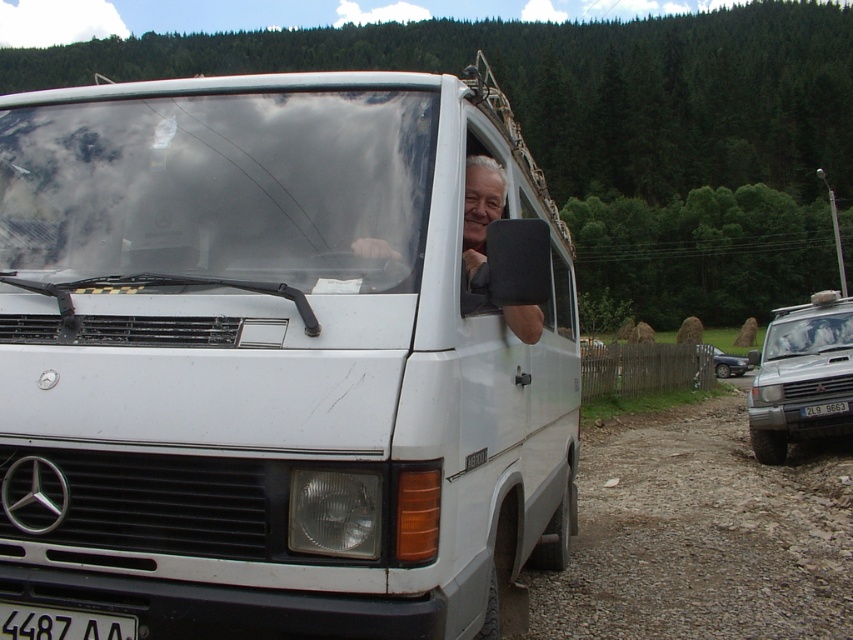
Question: Considering the relative positions of gray fabric shirt at center and black plastic license plate at center in the image provided, where is gray fabric shirt at center located with respect to black plastic license plate at center?

Choices:
 (A) right
 (B) left

Answer: (B)

Question: Which object is the closest to the white matte van at center?

Choices:
 (A) silver metallic suv at right
 (B) black plastic license plate at center
 (C) metallic silver sedan at right
 (D) black plastic license plate at lower center

Answer: (D)

Question: Which point is farther to the camera?

Choices:
 (A) silver metallic suv at right
 (B) black plastic license plate at center
 (C) gray fabric shirt at center
 (D) white matte van at center

Answer: (A)

Question: In this image, where is white matte van at center located relative to black plastic license plate at center?

Choices:
 (A) below
 (B) above

Answer: (B)

Question: Does gray fabric shirt at center come in front of black plastic license plate at lower center?

Choices:
 (A) yes
 (B) no

Answer: (B)

Question: Which object is closer to the camera taking this photo?

Choices:
 (A) silver metallic suv at right
 (B) metallic silver sedan at right
 (C) white matte van at center
 (D) black plastic license plate at lower center

Answer: (C)